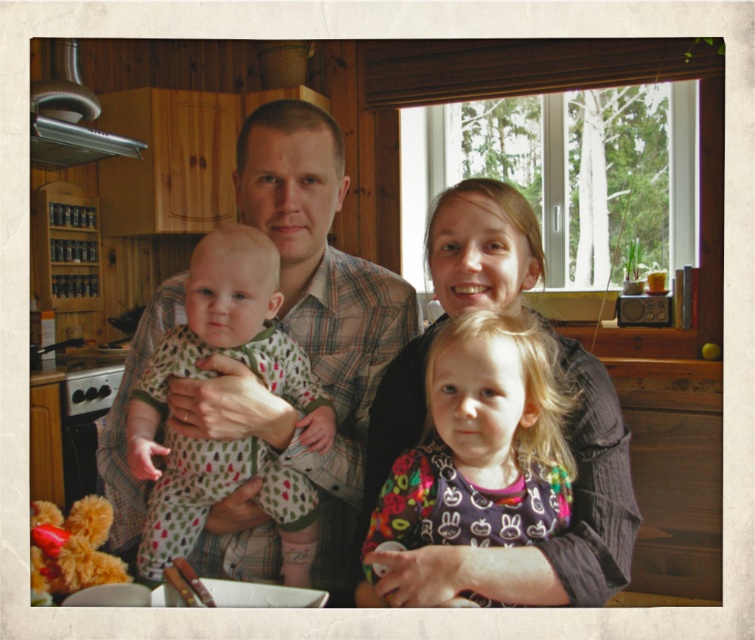
You are standing in the kitchen and want to hand a dish towel to the person wearing the plaid shirt at center. Based on their position, where would you need to walk to reach them?

The plaid shirt at center is located at coordinates point (307, 317), so you should walk towards the center of the kitchen to reach them.

Based on the scene description, where is the plaid shirt at center located in terms of coordinates?

The plaid shirt at center is located at coordinates point (307,317).